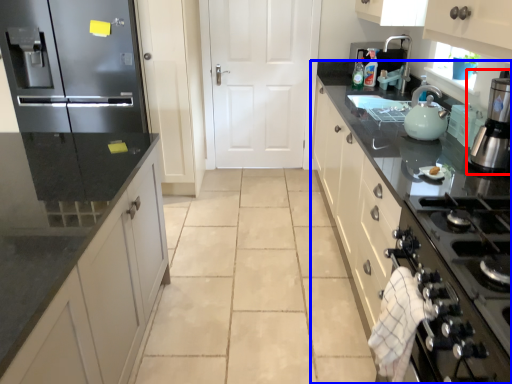
Question: Among these objects, which one is nearest to the camera, home appliance (highlighted by a red box) or countertop (highlighted by a blue box)?

Choices:
 (A) home appliance
 (B) countertop

Answer: (B)